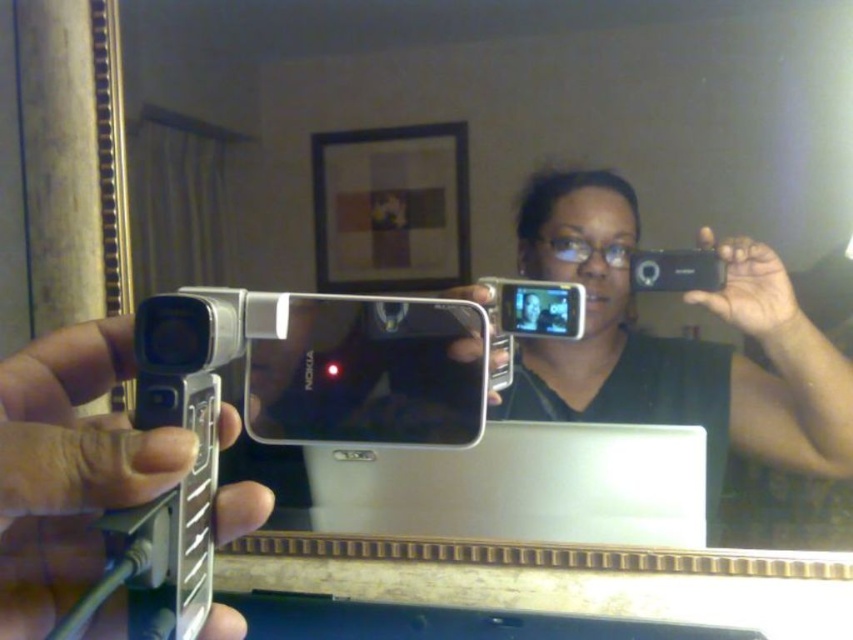
You are a photographer trying to capture a reflection of the silver metallic nokia camera at center and the matte black camera at upper center in the mirror selfie. Which camera will appear larger in the reflection?

The silver metallic nokia camera at center will appear larger in the reflection because it is closer to the viewer than the matte black camera at upper center.